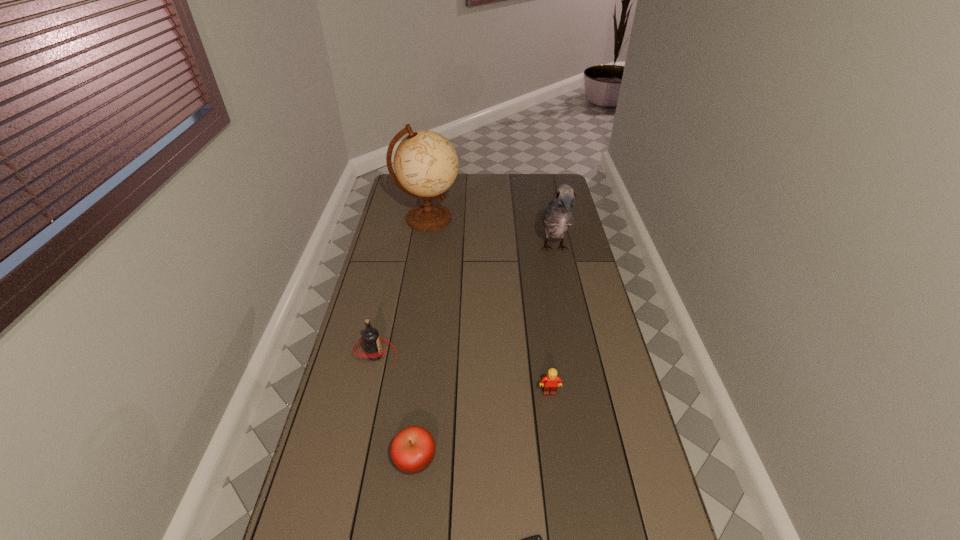
You are a GUI agent. You are given a task and a screenshot of the screen. Output one action in this format:
    pyautogui.click(x=<x>, y=<y>)
    Task: Click on the empty location between the third nearest object and the apple
    The image size is (960, 540).
    Given the screenshot: What is the action you would take?
    pyautogui.click(x=482, y=426)

At what (x,y) coordinates should I click in order to perform the action: click on vacant area that lies between the tallest object and the Lego. Please return your answer as a coordinate pair (x, y). This screenshot has height=540, width=960. Looking at the image, I should click on (489, 306).

I want to click on empty location between the root beer and the second tallest object, so click(x=465, y=302).

The width and height of the screenshot is (960, 540). Identify the location of vacant space that's between the tallest object and the fourth shortest object. (401, 287).

At what (x,y) coordinates should I click in order to perform the action: click on vacant space that is in between the fifth farthest object and the globe. Please return your answer as a coordinate pair (x, y). Looking at the image, I should click on (421, 339).

Locate which object is the closest to the parrot. Please provide its 2D coordinates. Your answer should be formatted as a tuple, i.e. [(x, y)], where the tuple contains the x and y coordinates of a point satisfying the conditions above.

[(426, 164)]

Where is `object that stands as the fourth closest to the apple`? The image size is (960, 540). object that stands as the fourth closest to the apple is located at coordinates (558, 216).

Image resolution: width=960 pixels, height=540 pixels. I want to click on vacant region that satisfies the following two spatial constraints: 1. on the surface of the second nearest object; 2. on the right side of the tallest object, so pos(389,459).

Locate an element on the screen. The width and height of the screenshot is (960, 540). free spot that satisfies the following two spatial constraints: 1. on the back side of the apple; 2. on the label of the root beer is located at coordinates (427, 355).

In order to click on vacant region that satisfies the following two spatial constraints: 1. on the label of the root beer; 2. on the right side of the apple in this screenshot , I will do `click(352, 459)`.